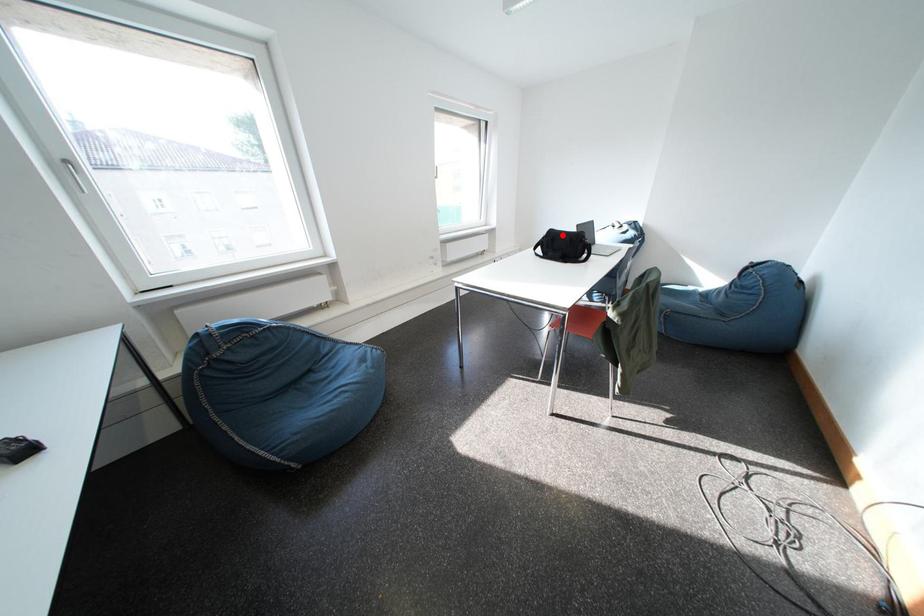
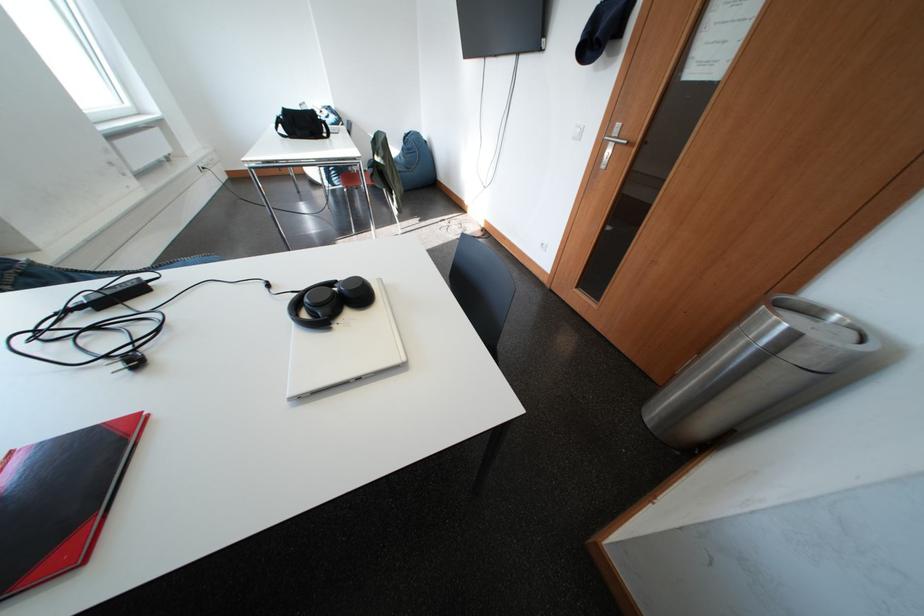
The point at the highlighted location is marked in the first image. Where is the corresponding point in the second image?

(297, 114)